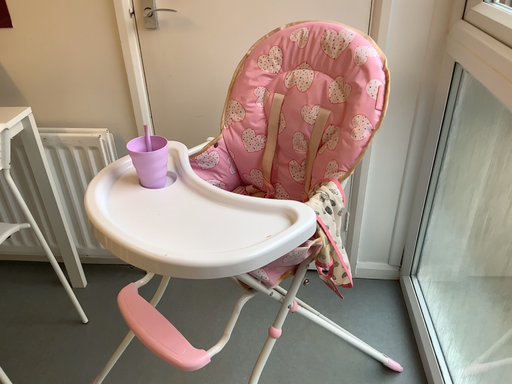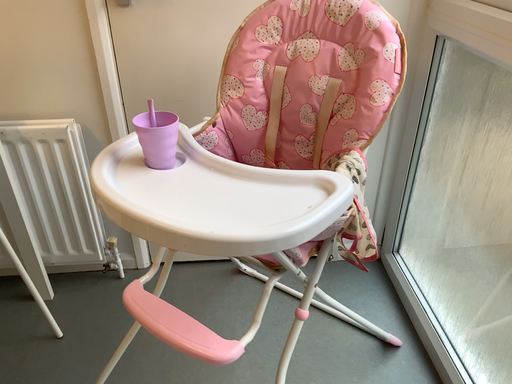
Question: How did the camera likely rotate when shooting the video?

Choices:
 (A) rotated right
 (B) rotated left

Answer: (A)